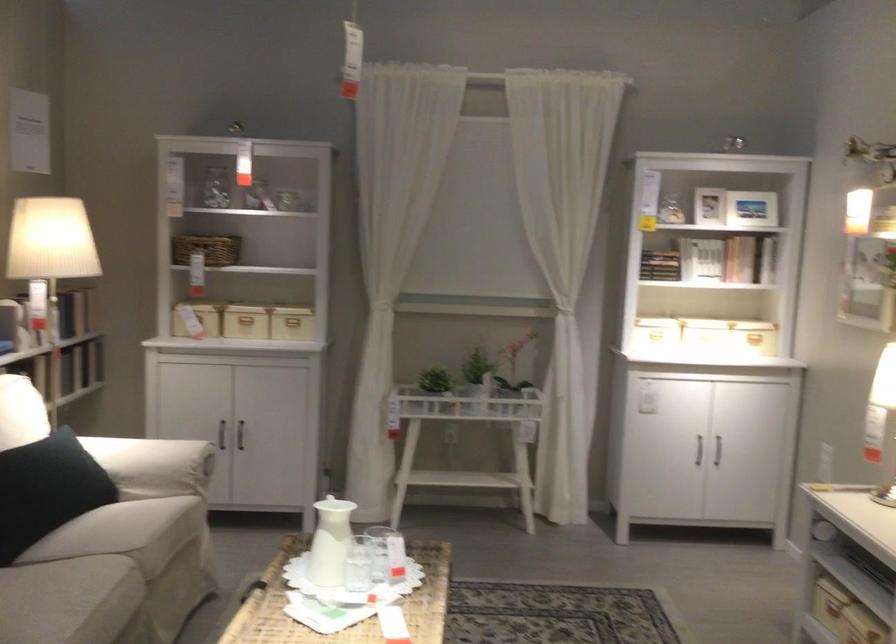
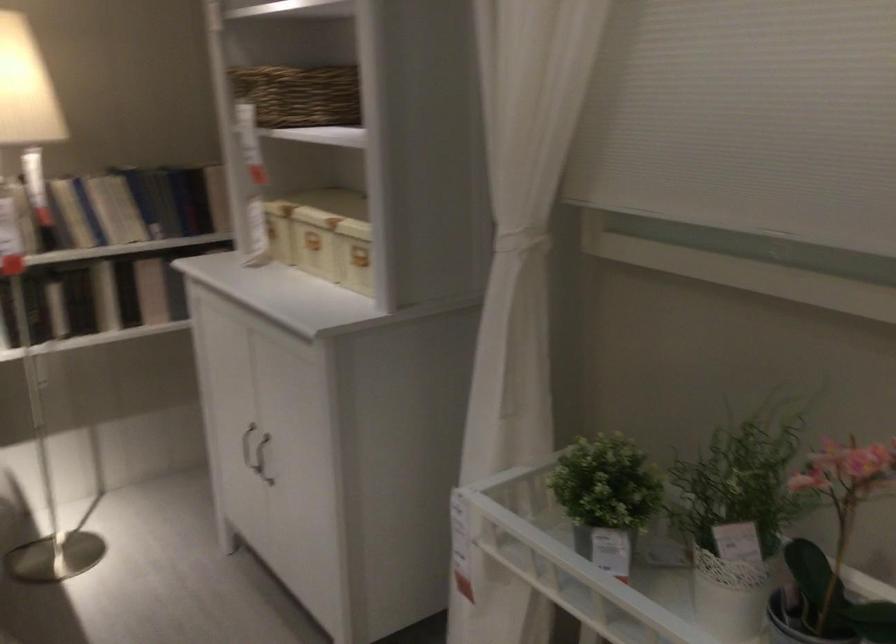
In the second image, find the point that corresponds to point 245,242 in the first image.

(298, 93)